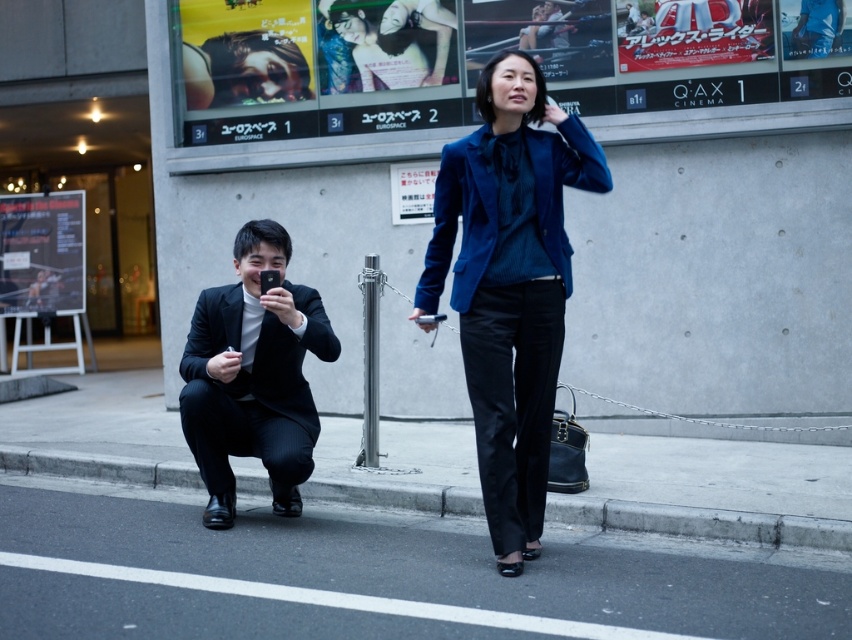
Does velvet blue blazer at center appear under black suit at left?

Incorrect, velvet blue blazer at center is not positioned below black suit at left.

Between point (548, 374) and point (245, 250), which one is positioned in front?

Point (548, 374) is more forward.

The image size is (852, 640). I want to click on velvet blue blazer at center, so click(x=509, y=284).

Is black suit at left wider than gray concrete curb at lower center?

Incorrect, black suit at left's width does not surpass gray concrete curb at lower center's.

Is point (252, 316) farther from viewer compared to point (628, 518)?

No.

Between point (190, 324) and point (312, 483), which one is positioned in front?

Point (312, 483) is in front.

This screenshot has height=640, width=852. What are the coordinates of `black suit at left` in the screenshot? It's located at (252, 376).

Does asphalt at lower center appear on the right side of velvet blue blazer at center?

Incorrect, asphalt at lower center is not on the right side of velvet blue blazer at center.

Does asphalt at lower center have a larger size compared to velvet blue blazer at center?

Incorrect, asphalt at lower center is not larger than velvet blue blazer at center.

Measure the distance between asphalt at lower center and camera.

The distance of asphalt at lower center from camera is 4.68 meters.

Locate an element on the screen. The width and height of the screenshot is (852, 640). asphalt at lower center is located at coordinates (367, 577).